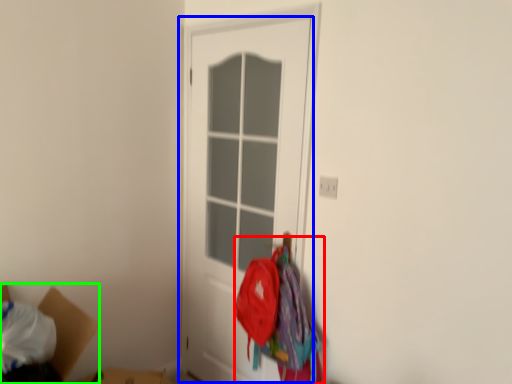
Question: Estimate the real-world distances between objects in this image. Which object is closer to laundry (highlighted by a red box), door (highlighted by a blue box) or cardboard box (highlighted by a green box)?

Choices:
 (A) door
 (B) cardboard box

Answer: (A)